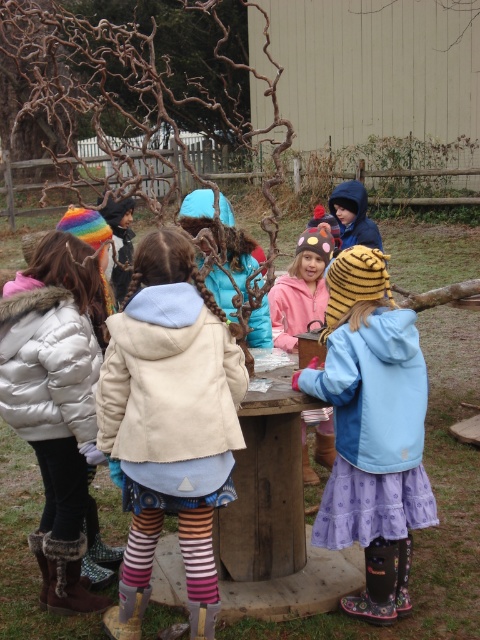
Who is positioned more to the left, beige wool coat at center or pink fleece jacket at center?

beige wool coat at center

Does point (130, 509) come closer to viewer compared to point (312, 294)?

Yes.

Locate an element on the screen. This screenshot has height=640, width=480. beige wool coat at center is located at coordinates (169, 422).

Which is more to the left, beige wool coat at center or blue fleece jacket at center?

Positioned to the left is beige wool coat at center.

The image size is (480, 640). What do you see at coordinates (169, 422) in the screenshot?
I see `beige wool coat at center` at bounding box center [169, 422].

Locate an element on the screen. This screenshot has width=480, height=640. beige wool coat at center is located at coordinates (169, 422).

This screenshot has height=640, width=480. I want to click on beige wool coat at center, so click(x=169, y=422).

Is white puffy jacket at left above pink fleece jacket at center?

No, white puffy jacket at left is not above pink fleece jacket at center.

Describe the element at coordinates (55, 403) in the screenshot. I see `white puffy jacket at left` at that location.

Between point (51, 490) and point (321, 456), which one is positioned in front?

Point (51, 490)

Locate an element on the screen. white puffy jacket at left is located at coordinates (x=55, y=403).